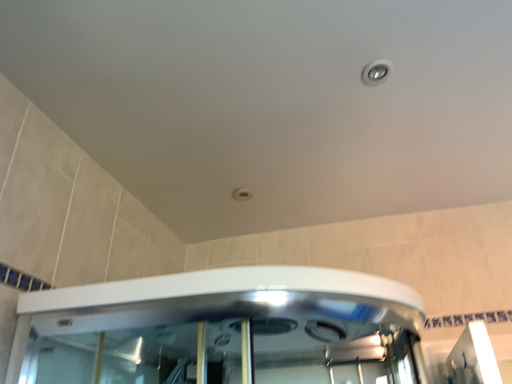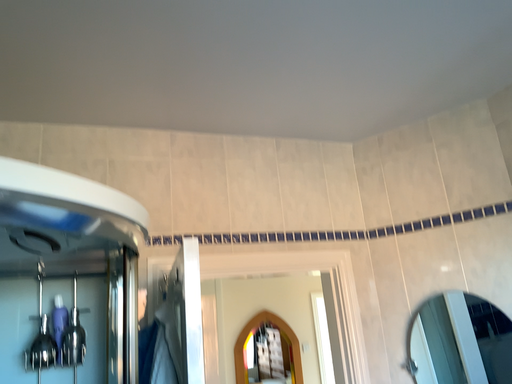
Question: Which way did the camera rotate in the video?

Choices:
 (A) rotated downward
 (B) rotated upward

Answer: (A)